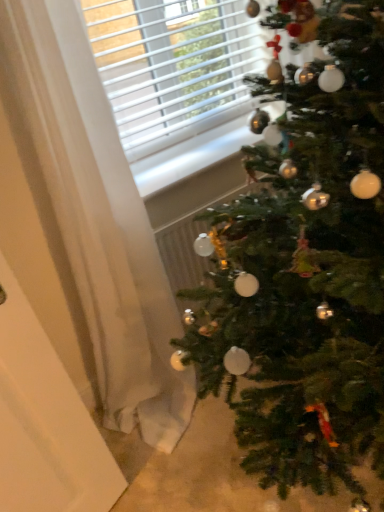
Question: Is green matte christmas tree at right smaller than white matte screen door at left?

Choices:
 (A) yes
 (B) no

Answer: (B)

Question: Can you confirm if green matte christmas tree at right is taller than white matte screen door at left?

Choices:
 (A) yes
 (B) no

Answer: (A)

Question: Is white matte screen door at left at the back of green matte christmas tree at right?

Choices:
 (A) no
 (B) yes

Answer: (A)

Question: Could you tell me if green matte christmas tree at right is facing white matte screen door at left?

Choices:
 (A) no
 (B) yes

Answer: (A)

Question: Is green matte christmas tree at right closer to camera compared to white matte screen door at left?

Choices:
 (A) no
 (B) yes

Answer: (B)

Question: From a real-world perspective, relative to green matte christmas tree at right, is white sheer curtain at left vertically above or below?

Choices:
 (A) below
 (B) above

Answer: (B)

Question: Is point (99, 109) positioned closer to the camera than point (382, 370)?

Choices:
 (A) closer
 (B) farther

Answer: (B)

Question: In the image, is white sheer curtain at left positioned in front of or behind green matte christmas tree at right?

Choices:
 (A) behind
 (B) front

Answer: (A)

Question: Visually, is white sheer curtain at left positioned to the left or to the right of green matte christmas tree at right?

Choices:
 (A) right
 (B) left

Answer: (B)

Question: Is white sheer curtain at left taller or shorter than white matte screen door at left?

Choices:
 (A) tall
 (B) short

Answer: (A)

Question: From the image's perspective, relative to white matte screen door at left, is white sheer curtain at left above or below?

Choices:
 (A) above
 (B) below

Answer: (A)

Question: Considering the positions of white sheer curtain at left and white matte screen door at left in the image, is white sheer curtain at left wider or thinner than white matte screen door at left?

Choices:
 (A) wide
 (B) thin

Answer: (A)

Question: Is white sheer curtain at left inside or outside of white matte screen door at left?

Choices:
 (A) inside
 (B) outside

Answer: (B)

Question: Is green matte christmas tree at right taller or shorter than white sheer curtain at left?

Choices:
 (A) short
 (B) tall

Answer: (A)

Question: Is point (367, 59) closer or farther from the camera than point (82, 47)?

Choices:
 (A) closer
 (B) farther

Answer: (A)